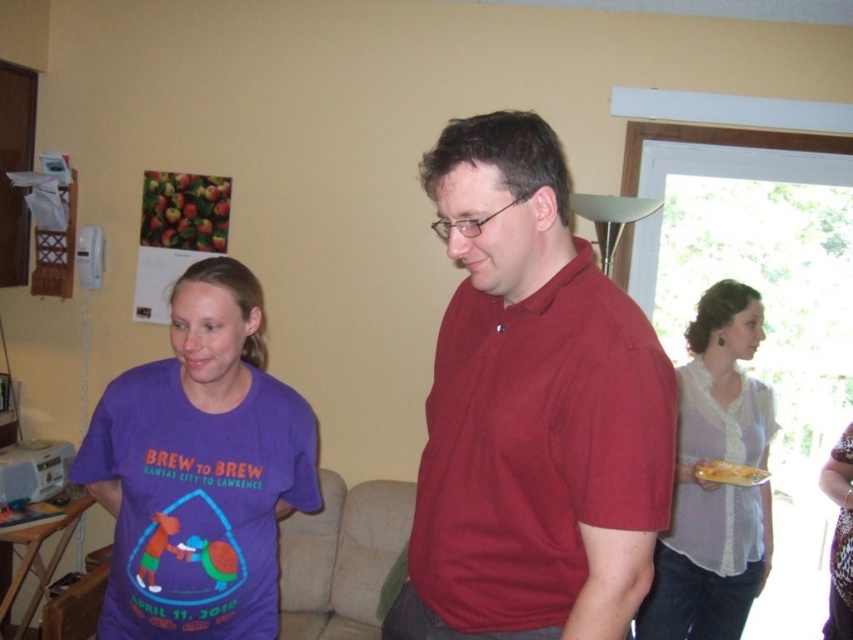
Who is taller, matte red shirt at center or yellow plastic plate at right?

matte red shirt at center

Is the position of matte red shirt at center less distant than that of yellow plastic plate at right?

Yes, it is in front of yellow plastic plate at right.

Does point (643, 320) come closer to viewer compared to point (751, 483)?

Yes, point (643, 320) is in front of point (751, 483).

Find the location of a particular element. This screenshot has width=853, height=640. matte red shirt at center is located at coordinates (531, 412).

Measure the distance from matte red shirt at center to white sheer blouse at center.

A distance of 4.68 feet exists between matte red shirt at center and white sheer blouse at center.

Which is behind, point (413, 566) or point (699, 556)?

The point (699, 556) is more distant.

Find the location of a particular element. This screenshot has width=853, height=640. matte red shirt at center is located at coordinates (531, 412).

In the scene shown: Is the position of purple cotton t-shirt at left more distant than that of yellow plastic plate at right?

No.

This screenshot has width=853, height=640. What are the coordinates of `purple cotton t-shirt at left` in the screenshot? It's located at (199, 470).

Does point (172, 627) lie in front of point (720, 465)?

That is True.

What are the coordinates of `purple cotton t-shirt at left` in the screenshot? It's located at (199, 470).